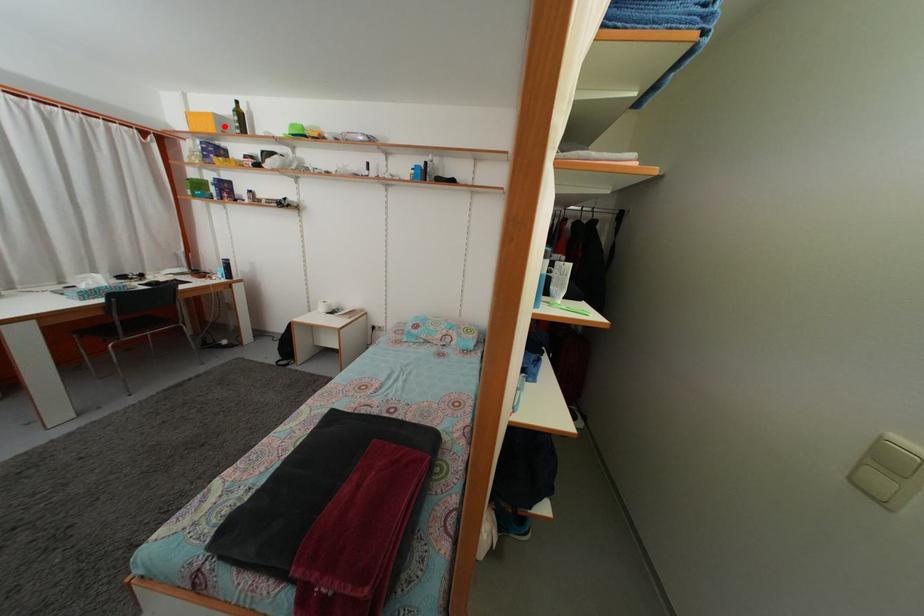
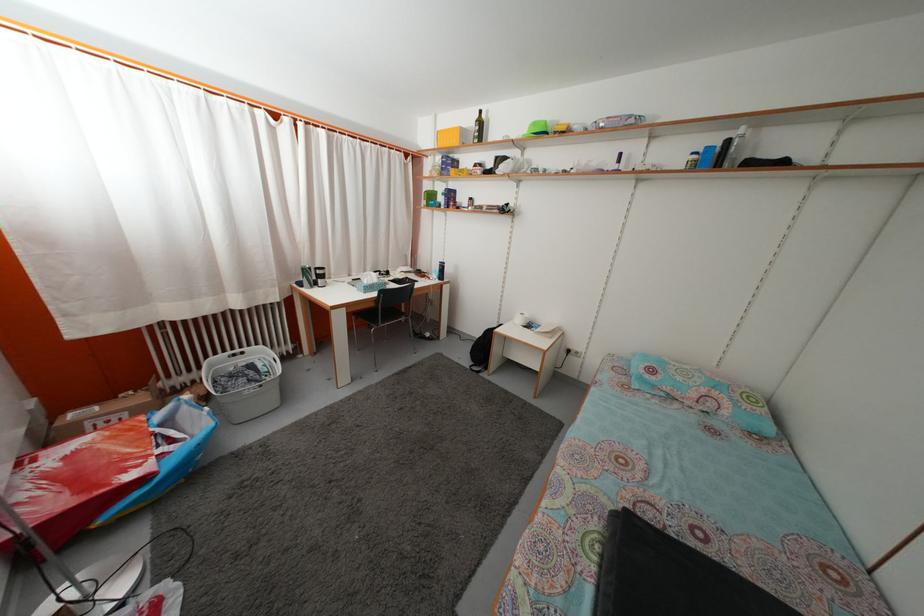
Question: I am providing you with two images of the same scene from different viewpoints. A red point is shown in image1. For the corresponding object point in image2, is it positioned nearer or farther from the camera?

Choices:
 (A) Nearer
 (B) Farther

Answer: (A)